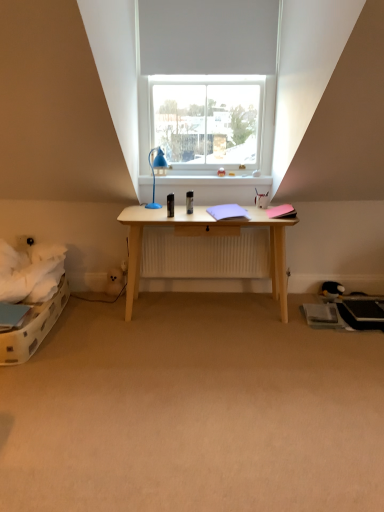
You are a GUI agent. You are given a task and a screenshot of the screen. Output one action in this format:
    pyautogui.click(x=<x>, y=<y>)
    Task: Click on the vacant region above white glossy window sill at upper center (from a real-world perspective)
    
    Given the screenshot: What is the action you would take?
    pyautogui.click(x=214, y=168)